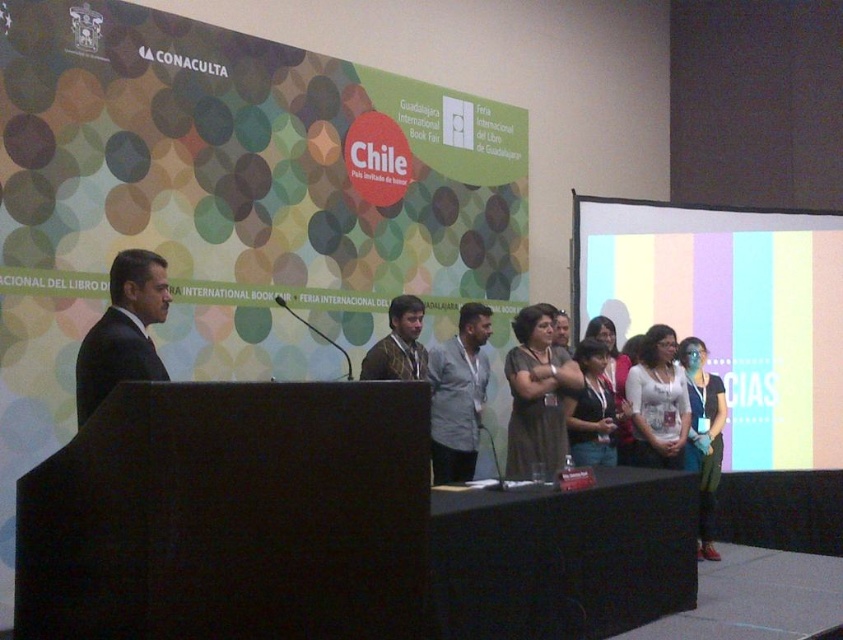
Locate an element on the screen. This screenshot has width=843, height=640. matte black jacket at lower right is located at coordinates tap(702, 435).

Locate an element on the screen. The height and width of the screenshot is (640, 843). matte black jacket at lower right is located at coordinates (702, 435).

Between white matte blouse at center and shiny brown suit at center, which one appears on the right side from the viewer's perspective?

From the viewer's perspective, white matte blouse at center appears more on the right side.

Which is more to the left, white matte blouse at center or shiny brown suit at center?

shiny brown suit at center is more to the left.

Image resolution: width=843 pixels, height=640 pixels. I want to click on white matte blouse at center, so click(658, 401).

Is point (162, 301) in front of point (654, 419)?

Yes, it is in front of point (654, 419).

Between black suit at left and white matte blouse at center, which one has more height?

white matte blouse at center is taller.

Is point (132, 257) positioned before point (654, 403)?

Yes, point (132, 257) is closer to viewer.

Image resolution: width=843 pixels, height=640 pixels. I want to click on black suit at left, so click(x=122, y=330).